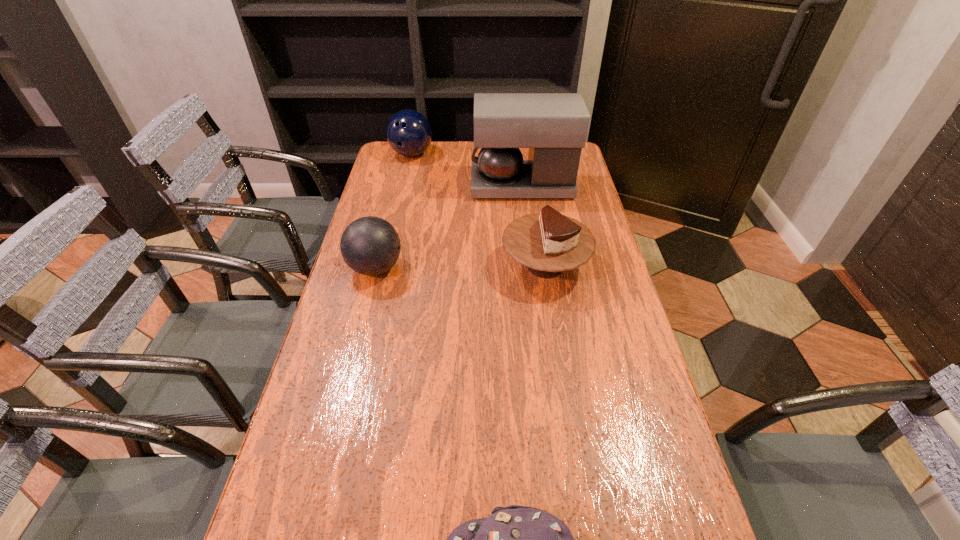
Locate an element on the screen. This screenshot has height=540, width=960. vacant region located on the grip area of the nearer bowling ball is located at coordinates (481, 268).

Locate an element on the screen. object that is positioned at the far edge is located at coordinates (408, 132).

Where is `coffee maker present at the right edge`? The image size is (960, 540). coffee maker present at the right edge is located at coordinates (554, 126).

In order to click on cake at the right edge in this screenshot , I will do `click(548, 242)`.

At what (x,y) coordinates should I click in order to perform the action: click on object located at the far left corner. Please return your answer as a coordinate pair (x, y). Image resolution: width=960 pixels, height=540 pixels. Looking at the image, I should click on (408, 132).

In order to click on vacant space at the left edge of the desktop in this screenshot , I will do pyautogui.click(x=371, y=194).

Locate an element on the screen. The height and width of the screenshot is (540, 960). free space at the right edge of the desktop is located at coordinates (581, 193).

The image size is (960, 540). In the image, there is a desktop. In order to click on vacant space at the far left corner in this screenshot , I will do `click(398, 155)`.

Locate an element on the screen. vacant space at the far right corner is located at coordinates pos(579,170).

At what (x,y) coordinates should I click in order to perform the action: click on unoccupied position between the cake and the nearer bowling ball. Please return your answer as a coordinate pair (x, y). Image resolution: width=960 pixels, height=540 pixels. Looking at the image, I should click on (461, 267).